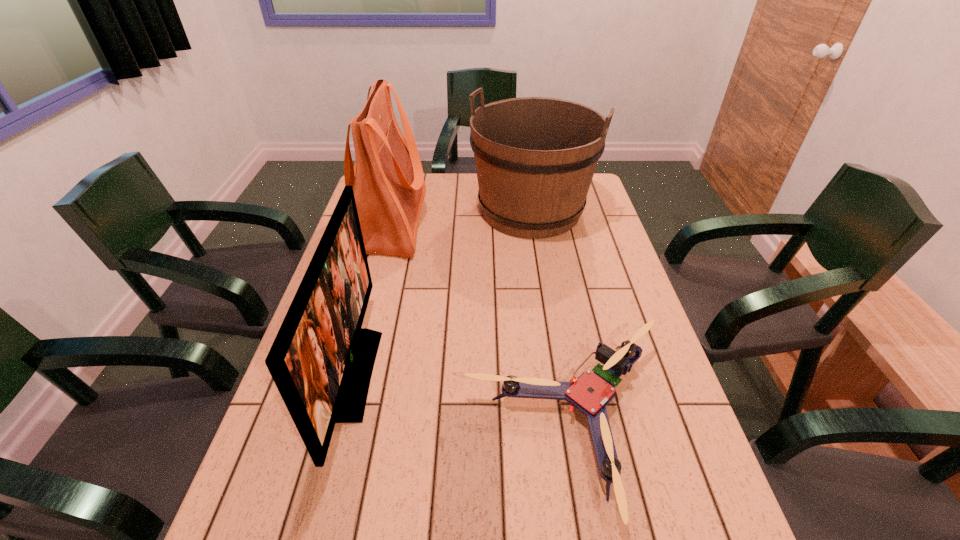
This screenshot has width=960, height=540. I want to click on object located at the right edge, so click(x=535, y=157).

Where is `object that is positioned at the far left corner`? The width and height of the screenshot is (960, 540). object that is positioned at the far left corner is located at coordinates (387, 178).

The height and width of the screenshot is (540, 960). I want to click on object that is at the far right corner, so click(x=535, y=157).

At what (x,y) coordinates should I click in order to perform the action: click on vacant space at the far edge of the desktop. Please return your answer as a coordinate pair (x, y). Looking at the image, I should click on (429, 186).

Find the location of a particular element. This screenshot has height=540, width=960. free space at the left edge of the desktop is located at coordinates (328, 498).

Image resolution: width=960 pixels, height=540 pixels. I want to click on free space at the right edge of the desktop, so click(x=677, y=497).

The height and width of the screenshot is (540, 960). Identify the location of free area in between the shopping bag and the bucket. (461, 216).

I want to click on vacant area that lies between the bucket and the monitor, so click(x=443, y=292).

Find the location of a particular element. This screenshot has width=960, height=540. free space that is in between the bucket and the monitor is located at coordinates (443, 292).

Where is `free space that is in between the bucket and the monitor`? free space that is in between the bucket and the monitor is located at coordinates (443, 292).